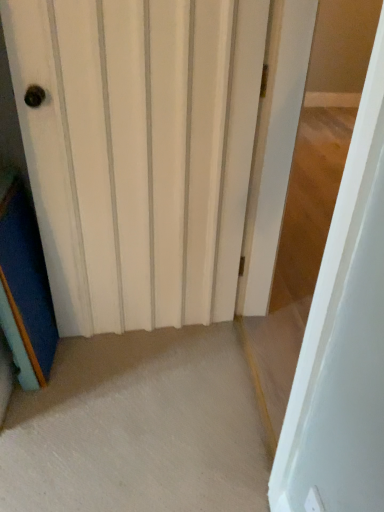
Question: Considering the relative positions of white matte door at center, the 1th door when ordered from right to left, and white wood door at center, positioned as the 1th door in left-to-right order, in the image provided, is white matte door at center, the 1th door when ordered from right to left, to the left or to the right of white wood door at center, positioned as the 1th door in left-to-right order,?

Choices:
 (A) left
 (B) right

Answer: (B)

Question: Looking at the image, does white matte door at center, the 1th door when ordered from right to left, seem bigger or smaller compared to white wood door at center, arranged as the second door when viewed from the right?

Choices:
 (A) small
 (B) big

Answer: (B)

Question: Considering their positions, is white matte door at center, the 1th door when ordered from right to left, located in front of or behind white wood door at center, positioned as the 1th door in left-to-right order?

Choices:
 (A) behind
 (B) front

Answer: (B)

Question: Is white wood door at center, positioned as the 1th door in left-to-right order, taller or shorter than white matte door at center, the 1th door when ordered from right to left?

Choices:
 (A) tall
 (B) short

Answer: (B)

Question: Is white wood door at center, arranged as the second door when viewed from the right, wider or thinner than white matte door at center, the 1th door when ordered from right to left?

Choices:
 (A) thin
 (B) wide

Answer: (A)

Question: Does point (79, 84) appear closer or farther from the camera than point (362, 237)?

Choices:
 (A) farther
 (B) closer

Answer: (A)

Question: In the image, is white wood door at center, arranged as the second door when viewed from the right, on the left side or the right side of white matte door at center, acting as the second door starting from the left?

Choices:
 (A) left
 (B) right

Answer: (A)